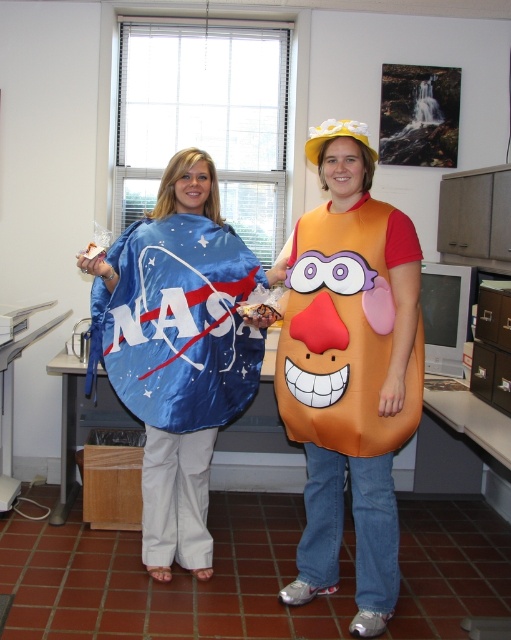
Is shiny blue nasa cape at left wider than orange fabric potato at center?

Correct, the width of shiny blue nasa cape at left exceeds that of orange fabric potato at center.

Looking at this image, does shiny blue nasa cape at left have a lesser height compared to orange fabric potato at center?

In fact, shiny blue nasa cape at left may be taller than orange fabric potato at center.

Where is `shiny blue nasa cape at left`? shiny blue nasa cape at left is located at coordinates (350, 369).

Is blue fabric nasa cape at left thinner than orange fabric potato at center?

Incorrect, blue fabric nasa cape at left's width is not less than orange fabric potato at center's.

Is point (192, 548) less distant than point (288, 348)?

That is False.

Find the location of a particular element. The height and width of the screenshot is (640, 511). blue fabric nasa cape at left is located at coordinates (177, 349).

The image size is (511, 640). I want to click on blue fabric nasa cape at left, so click(x=177, y=349).

Does shiny blue nasa cape at left have a greater height compared to blue fabric nasa cape at left?

Indeed, shiny blue nasa cape at left has a greater height compared to blue fabric nasa cape at left.

Who is shorter, shiny blue nasa cape at left or blue fabric nasa cape at left?

Standing shorter between the two is blue fabric nasa cape at left.

Identify the location of shiny blue nasa cape at left. The image size is (511, 640). (350, 369).